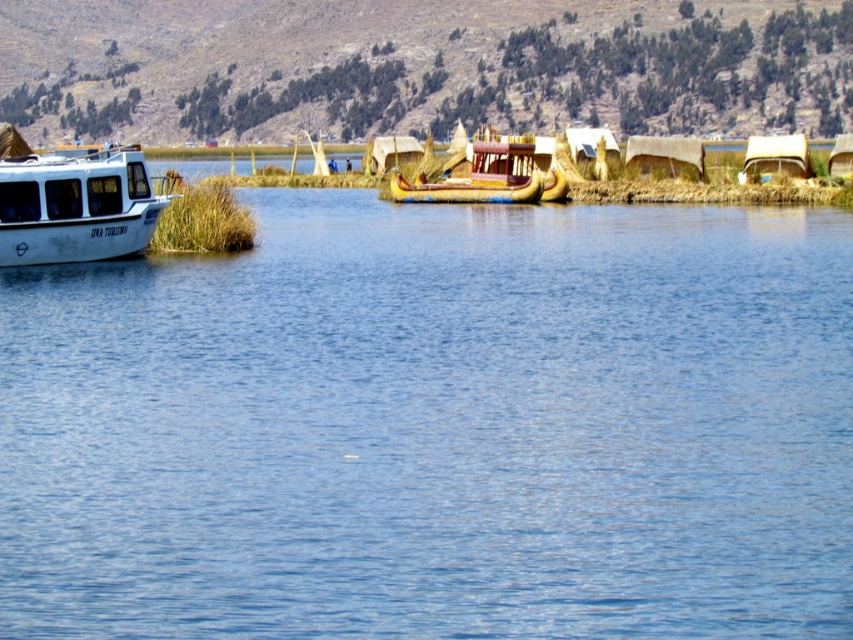
Who is taller, white matte boat at left or golden woven reed boat at center?

Standing taller between the two is white matte boat at left.

Is white matte boat at left wider than golden woven reed boat at center?

Correct, the width of white matte boat at left exceeds that of golden woven reed boat at center.

Is point (102, 189) behind point (564, 179)?

No, it is not.

The image size is (853, 640). Find the location of `white matte boat at left`. white matte boat at left is located at coordinates (74, 205).

What do you see at coordinates (436, 428) in the screenshot?
I see `blue water at center` at bounding box center [436, 428].

Between blue water at center and white matte boat at left, which one has less height?

With less height is white matte boat at left.

Describe the element at coordinates (436, 428) in the screenshot. Image resolution: width=853 pixels, height=640 pixels. I see `blue water at center` at that location.

Identify the location of blue water at center. This screenshot has width=853, height=640. pos(436,428).

Consider the image. Can you confirm if blue water at center is taller than golden woven reed boat at center?

Indeed, blue water at center has a greater height compared to golden woven reed boat at center.

Does point (752, 522) come closer to viewer compared to point (554, 177)?

Yes, point (752, 522) is in front of point (554, 177).

At what (x,y) coordinates should I click in order to perform the action: click on blue water at center. Please return your answer as a coordinate pair (x, y). Looking at the image, I should click on (436, 428).